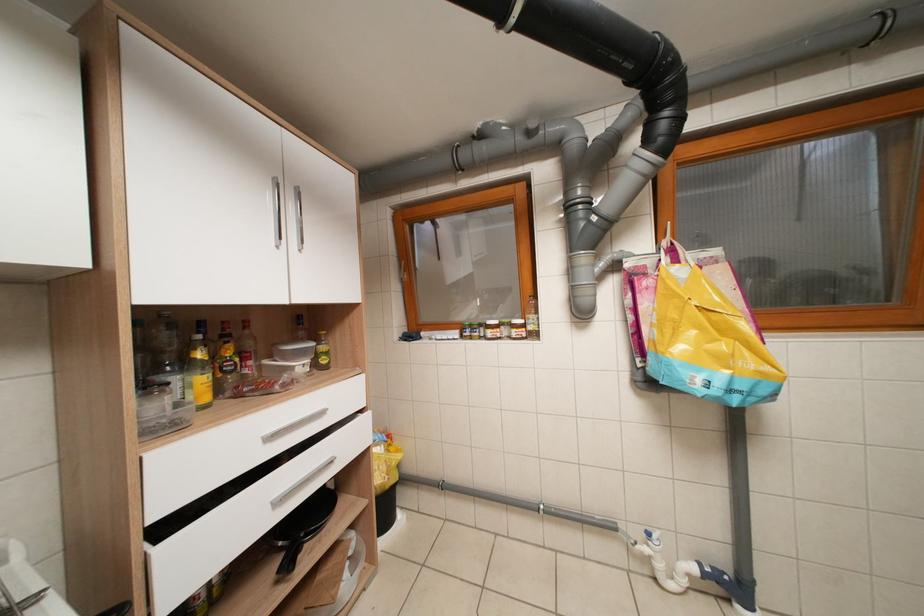
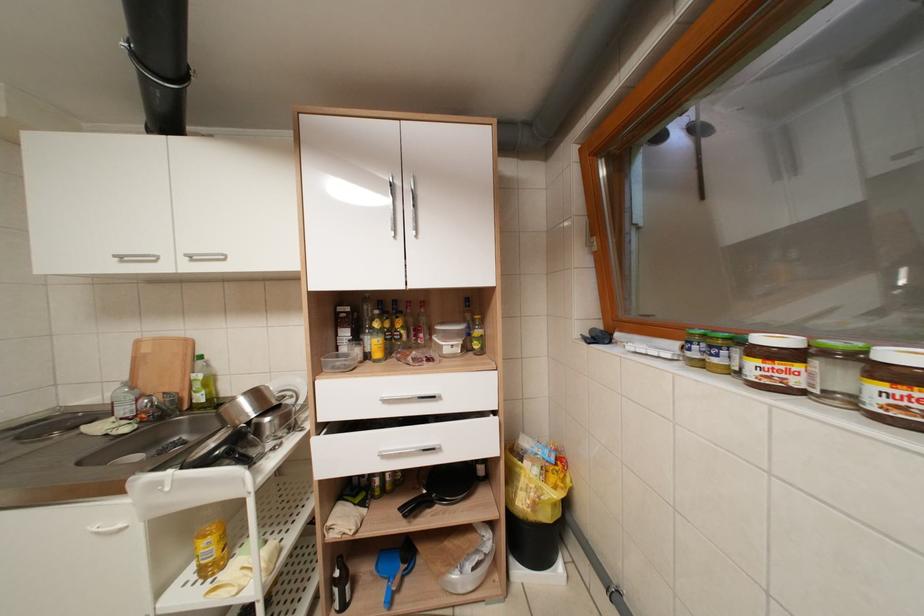
Question: The images are taken continuously from a first-person perspective. In which direction is your viewpoint rotating?

Choices:
 (A) Left
 (B) Right
 (C) Up
 (D) Down

Answer: (A)